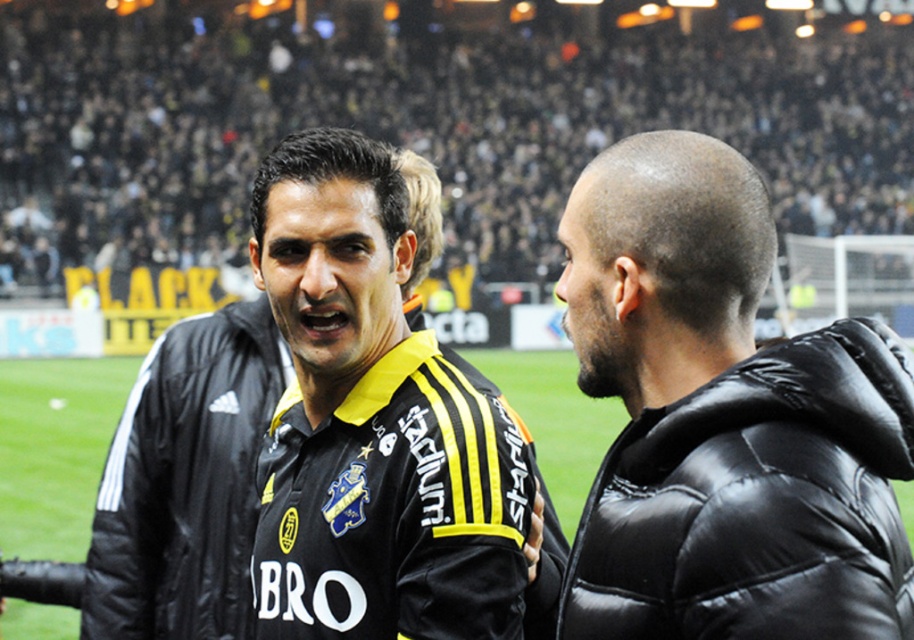
Does black puffy jacket at right appear on the left side of yellow/black striped jersey at center?

In fact, black puffy jacket at right is to the right of yellow/black striped jersey at center.

Which is behind, point (622, 611) or point (408, 538)?

Point (408, 538)

Between point (623, 604) and point (477, 582), which one is positioned in front?

Point (623, 604)

What are the coordinates of `black puffy jacket at right` in the screenshot? It's located at (724, 420).

Can you confirm if black matte jersey at center is thinner than black puffy jacket at right?

No.

Does black matte jersey at center have a greater width compared to black puffy jacket at right?

Yes.

Which is behind, point (729, 474) or point (665, 234)?

Positioned behind is point (665, 234).

You are a GUI agent. You are given a task and a screenshot of the screen. Output one action in this format:
    pyautogui.click(x=<x>, y=<y>)
    Task: Click on the black matte jersey at center
    The width and height of the screenshot is (914, 640).
    Given the screenshot: What is the action you would take?
    pyautogui.click(x=724, y=420)

Can you confirm if black matte jersey at center is positioned to the left of yellow/black striped jersey at center?

No, black matte jersey at center is not to the left of yellow/black striped jersey at center.

Which is in front, point (776, 552) or point (360, 301)?

Point (776, 552) is more forward.

At what (x,y) coordinates should I click in order to perform the action: click on black matte jersey at center. Please return your answer as a coordinate pair (x, y). The image size is (914, 640). Looking at the image, I should click on (724, 420).